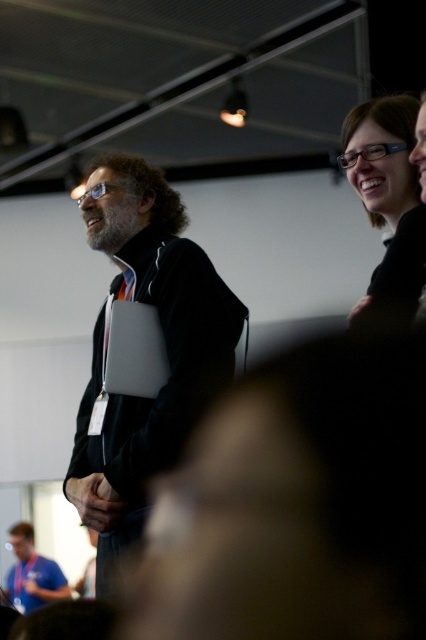
You are a photographer trying to capture a candid shot of the two individuals in the scene. You notice the matte black glasses at upper right and the blue fabric shirt at lower left. Which object should you focus on first if you want to photograph the taller one?

The blue fabric shirt at lower left is taller than the matte black glasses at upper right, so you should focus on the blue fabric shirt at lower left first.

You are standing in the conference room and want to reach a specific point marked at coordinates point (393, 316). If your arm can reach up to 25 inches, can you touch that point without moving your feet?

The distance of point (393, 316) from viewer is 26.87 inches, so you cannot touch it with your arm which can reach up to 25 inches without moving your feet.

You are a photographer at this event and want to ensure both the black matte jacket at center and the blue fabric shirt at lower left are clearly visible in your photo. Given their sizes, which one might require you to adjust your camera focus more carefully to avoid blurriness?

The black matte jacket at center has a larger size compared to the blue fabric shirt at lower left, so it might require more careful focus adjustment to ensure clarity due to its larger size.